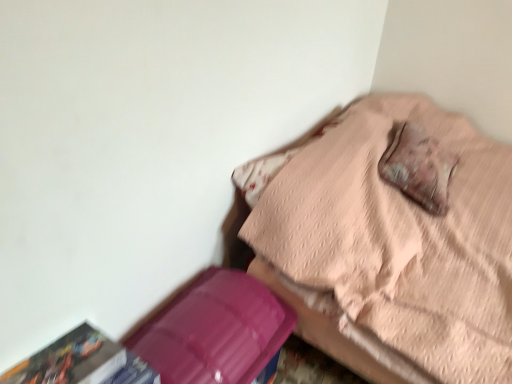
Measure the distance between pink quilted bed at upper right and camera.

pink quilted bed at upper right and camera are 3.86 feet apart.

Locate an element on the screen. multicolored paper at lower left is located at coordinates (82, 362).

What is the approximate width of purple plastic box at lower left?

purple plastic box at lower left is 14.64 inches in width.

What do you see at coordinates (215, 330) in the screenshot?
I see `purple plastic box at lower left` at bounding box center [215, 330].

The width and height of the screenshot is (512, 384). Identify the location of pink quilted bed at upper right. (393, 242).

Considering the positions of points (78, 346) and (256, 213), is point (78, 346) closer to camera compared to point (256, 213)?

Yes, it is in front of point (256, 213).

Can you confirm if multicolored paper at lower left is positioned to the left of pink quilted bed at upper right?

Yes, multicolored paper at lower left is to the left of pink quilted bed at upper right.

Considering the relative sizes of multicolored paper at lower left and pink quilted bed at upper right in the image provided, is multicolored paper at lower left thinner than pink quilted bed at upper right?

Yes, multicolored paper at lower left is thinner than pink quilted bed at upper right.

Is multicolored paper at lower left not near pink quilted bed at upper right?

Actually, multicolored paper at lower left and pink quilted bed at upper right are a little close together.

Which object is positioned more to the left, purple plastic box at lower left or leather-like brown pillow at upper right?

Positioned to the left is purple plastic box at lower left.

Could you tell me if purple plastic box at lower left is turned towards leather-like brown pillow at upper right?

No, purple plastic box at lower left does not turn towards leather-like brown pillow at upper right.

The image size is (512, 384). I want to click on cardboard box below the leather-like brown pillow at upper right (from the image's perspective), so click(215, 330).

Can you confirm if purple plastic box at lower left is taller than leather-like brown pillow at upper right?

Correct, purple plastic box at lower left is much taller as leather-like brown pillow at upper right.

Between pink quilted bed at upper right and multicolored paper at lower left, which one has smaller width?

multicolored paper at lower left.

Is multicolored paper at lower left inside pink quilted bed at upper right?

No, multicolored paper at lower left is not inside pink quilted bed at upper right.

From the image's perspective, is pink quilted bed at upper right on multicolored paper at lower left?

Yes, from the image's perspective, pink quilted bed at upper right is over multicolored paper at lower left.

Is pink quilted bed at upper right oriented away from purple plastic box at lower left?

No, purple plastic box at lower left is not at the back of pink quilted bed at upper right.

Could purple plastic box at lower left be considered to be inside pink quilted bed at upper right?

No, purple plastic box at lower left is not inside pink quilted bed at upper right.

From a real-world perspective, does pink quilted bed at upper right stand above purple plastic box at lower left?

Indeed, from a real-world perspective, pink quilted bed at upper right stands above purple plastic box at lower left.

How distant is pink quilted bed at upper right from purple plastic box at lower left?

A distance of 17.24 inches exists between pink quilted bed at upper right and purple plastic box at lower left.

Based on their sizes in the image, would you say multicolored paper at lower left is bigger or smaller than leather-like brown pillow at upper right?

Considering their sizes, multicolored paper at lower left takes up less space than leather-like brown pillow at upper right.

Does multicolored paper at lower left lie in front of leather-like brown pillow at upper right?

Yes, multicolored paper at lower left is in front of leather-like brown pillow at upper right.

Is multicolored paper at lower left looking in the opposite direction of leather-like brown pillow at upper right?

multicolored paper at lower left is not turned away from leather-like brown pillow at upper right.

Looking at this image, what's the angular difference between multicolored paper at lower left and leather-like brown pillow at upper right's facing directions?

The angle between the facing direction of multicolored paper at lower left and the facing direction of leather-like brown pillow at upper right is 81.5 degrees.

Where is `pillow above the multicolored paper at lower left (from the image's perspective)`? This screenshot has height=384, width=512. pillow above the multicolored paper at lower left (from the image's perspective) is located at coordinates (419, 167).

Would you say leather-like brown pillow at upper right is to the left or to the right of multicolored paper at lower left in the picture?

Clearly, leather-like brown pillow at upper right is on the right of multicolored paper at lower left in the image.

Which of these two, leather-like brown pillow at upper right or multicolored paper at lower left, is smaller?

multicolored paper at lower left is smaller.

From the image's perspective, which one is positioned higher, leather-like brown pillow at upper right or multicolored paper at lower left?

leather-like brown pillow at upper right.

Which is less distant, (225, 348) or (483, 241)?

The point (225, 348) is closer to the camera.

Considering the relative positions of purple plastic box at lower left and pink quilted bed at upper right in the image provided, is purple plastic box at lower left in front of pink quilted bed at upper right?

No, purple plastic box at lower left is further to the viewer.

Is purple plastic box at lower left facing towards pink quilted bed at upper right?

No, purple plastic box at lower left does not turn towards pink quilted bed at upper right.

At what (x,y) coordinates should I click in order to perform the action: click on furniture that is behind the multicolored paper at lower left. Please return your answer as a coordinate pair (x, y). Looking at the image, I should click on (393, 242).

In the image, there is a leather-like brown pillow at upper right. Identify the location of cardboard box below it (from a real-world perspective). (215, 330).

Based on their spatial positions, is pink quilted bed at upper right or purple plastic box at lower left further from leather-like brown pillow at upper right?

Among the two, purple plastic box at lower left is located further to leather-like brown pillow at upper right.

Considering their positions, is leather-like brown pillow at upper right positioned further to multicolored paper at lower left than purple plastic box at lower left?

leather-like brown pillow at upper right is positioned further to the anchor multicolored paper at lower left.

Estimate the real-world distances between objects in this image. Which object is closer to purple plastic box at lower left, pink quilted bed at upper right or leather-like brown pillow at upper right?

Among the two, pink quilted bed at upper right is located nearer to purple plastic box at lower left.

Based on their spatial positions, is purple plastic box at lower left or pink quilted bed at upper right closer to leather-like brown pillow at upper right?

Based on the image, pink quilted bed at upper right appears to be nearer to leather-like brown pillow at upper right.

Looking at the image, which one is located further to multicolored paper at lower left, pink quilted bed at upper right or leather-like brown pillow at upper right?

leather-like brown pillow at upper right.

From the image, which object appears to be farther from pink quilted bed at upper right, multicolored paper at lower left or purple plastic box at lower left?

multicolored paper at lower left lies further to pink quilted bed at upper right than the other object.

Looking at the image, which one is located closer to multicolored paper at lower left, purple plastic box at lower left or leather-like brown pillow at upper right?

The object closer to multicolored paper at lower left is purple plastic box at lower left.

Based on their spatial positions, is leather-like brown pillow at upper right or pink quilted bed at upper right further from purple plastic box at lower left?

leather-like brown pillow at upper right is further to purple plastic box at lower left.

The image size is (512, 384). I want to click on furniture between purple plastic box at lower left and leather-like brown pillow at upper right in the horizontal direction, so click(x=393, y=242).

At what (x,y) coordinates should I click in order to perform the action: click on cardboard box situated between multicolored paper at lower left and leather-like brown pillow at upper right from left to right. Please return your answer as a coordinate pair (x, y). The width and height of the screenshot is (512, 384). Looking at the image, I should click on (215, 330).

You are a GUI agent. You are given a task and a screenshot of the screen. Output one action in this format:
    pyautogui.click(x=<x>, y=<y>)
    Task: Click on the furniture between multicolored paper at lower left and leather-like brown pillow at upper right in the horizontal direction
    The image size is (512, 384).
    Given the screenshot: What is the action you would take?
    pyautogui.click(x=393, y=242)

Locate an element on the screen. Image resolution: width=512 pixels, height=384 pixels. cardboard box located between multicolored paper at lower left and pink quilted bed at upper right in the left-right direction is located at coordinates (215, 330).